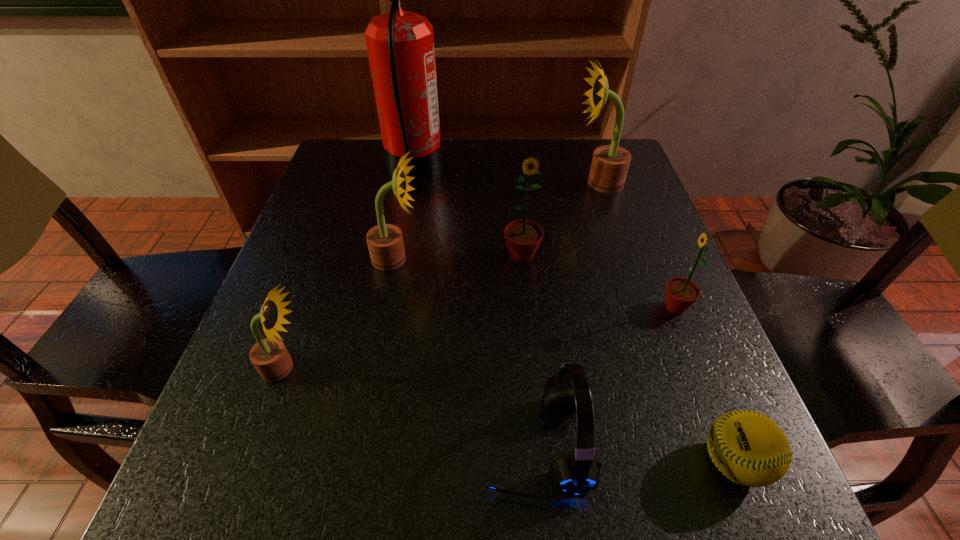
At what (x,y) coordinates should I click in order to perform the action: click on vacant point located between the tallest object and the rightmost yellow sunflower. Please return your answer as a coordinate pair (x, y). This screenshot has width=960, height=540. Looking at the image, I should click on (506, 176).

Locate an element on the screen. free point between the farthest sunflower and the third sunflower from left to right is located at coordinates (560, 220).

The height and width of the screenshot is (540, 960). I want to click on free space between the seventh tallest object and the fourth nearest object, so click(606, 375).

Find the location of a particular element. The image size is (960, 540). free spot between the headset and the farther green sunflower is located at coordinates (529, 350).

The width and height of the screenshot is (960, 540). In order to click on free space between the second biggest yellow sunflower and the nearer green sunflower in this screenshot , I will do `click(536, 283)`.

Identify the location of free space between the second biggest yellow sunflower and the farthest sunflower. Image resolution: width=960 pixels, height=540 pixels. (497, 221).

Image resolution: width=960 pixels, height=540 pixels. Find the location of `free space between the seventh tallest object and the smaller green sunflower`. free space between the seventh tallest object and the smaller green sunflower is located at coordinates (606, 375).

The width and height of the screenshot is (960, 540). Identify the location of object that is the fourth nearest to the shortest object. (385, 243).

Locate which object ranks seventh in proximity to the farthest yellow sunflower. Please provide its 2D coordinates. Your answer should be formatted as a tuple, i.e. [(x, y)], where the tuple contains the x and y coordinates of a point satisfying the conditions above.

[(269, 356)]

Choose which sunflower is the third nearest neighbor to the biggest yellow sunflower. Please provide its 2D coordinates. Your answer should be formatted as a tuple, i.e. [(x, y)], where the tuple contains the x and y coordinates of a point satisfying the conditions above.

[(385, 243)]